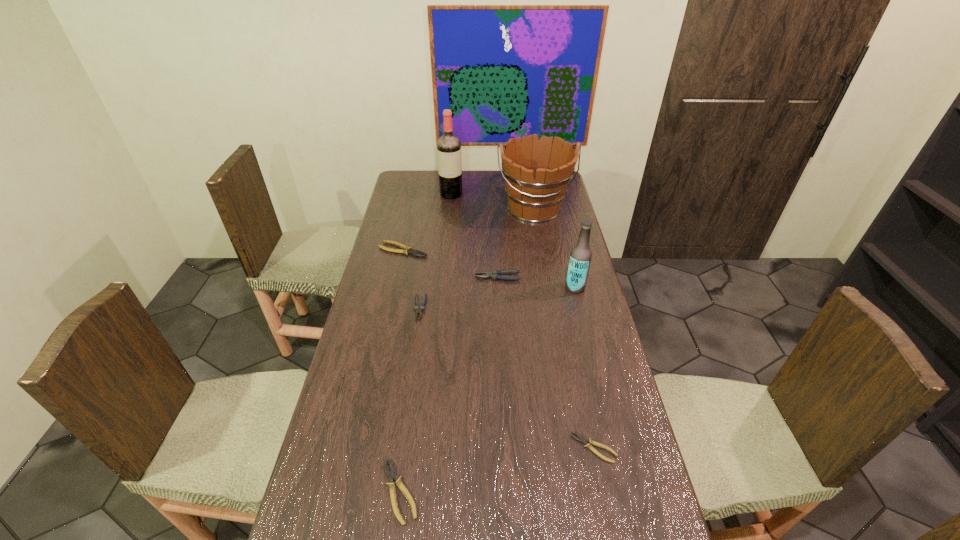
Find the location of a particular element. free space located at the gripping part of the bigger gray pliers is located at coordinates (369, 277).

Image resolution: width=960 pixels, height=540 pixels. I want to click on blank space located on the back of the biggest yellow pliers, so click(407, 232).

Locate an element on the screen. The image size is (960, 540). vacant space located at the gripping part of the third farthest pliers is located at coordinates (407, 398).

Locate an element on the screen. vacant position located 0.240m on the right of the fourth tallest pliers is located at coordinates (519, 491).

Locate an element on the screen. This screenshot has width=960, height=540. vacant area located 0.090m on the left of the smallest yellow pliers is located at coordinates (538, 448).

Where is `liquor at the far edge`? The image size is (960, 540). liquor at the far edge is located at coordinates (448, 146).

This screenshot has width=960, height=540. Find the location of `wine bucket that is at the far edge`. wine bucket that is at the far edge is located at coordinates (537, 173).

Locate an element on the screen. The height and width of the screenshot is (540, 960). object positioned at the left edge is located at coordinates (406, 250).

Where is `wine bucket that is positioned at the right edge`? This screenshot has width=960, height=540. wine bucket that is positioned at the right edge is located at coordinates (537, 173).

Locate an element on the screen. The height and width of the screenshot is (540, 960). beer bottle that is positioned at the right edge is located at coordinates (580, 257).